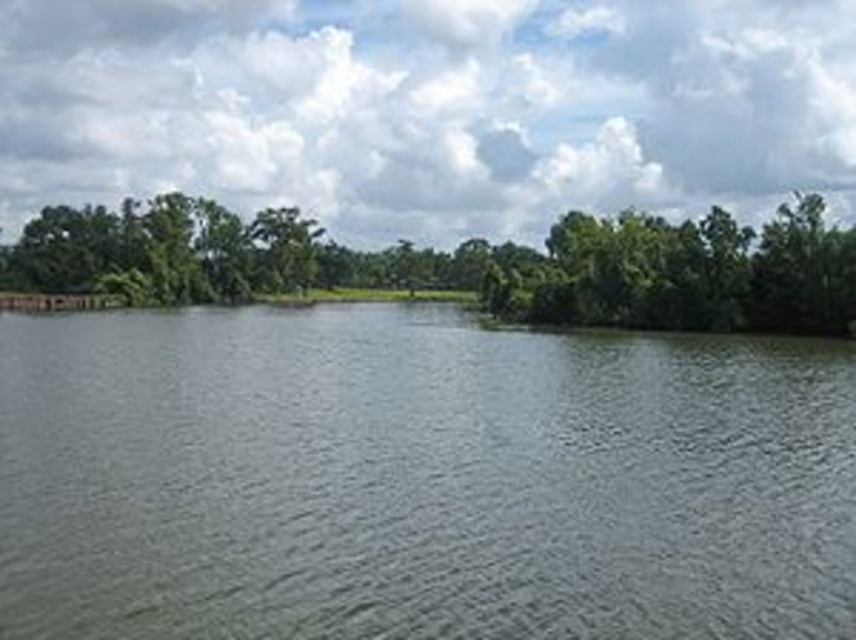
Based on the photo, is gray smooth water at center positioned behind green leafy trees at center?

That is False.

Is point (428, 461) in front of point (257, 220)?

That is True.

Where is `gray smooth water at center`? The height and width of the screenshot is (640, 856). gray smooth water at center is located at coordinates (418, 477).